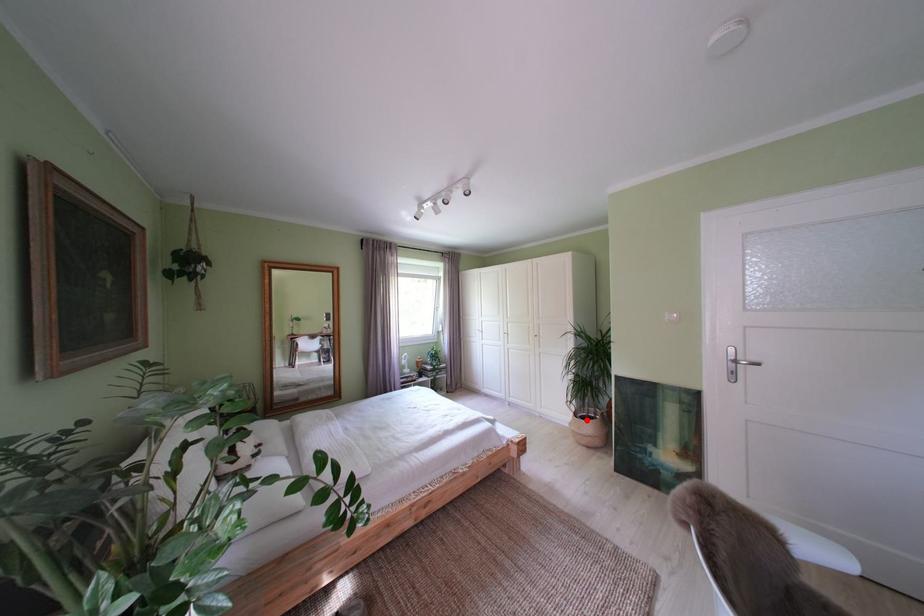
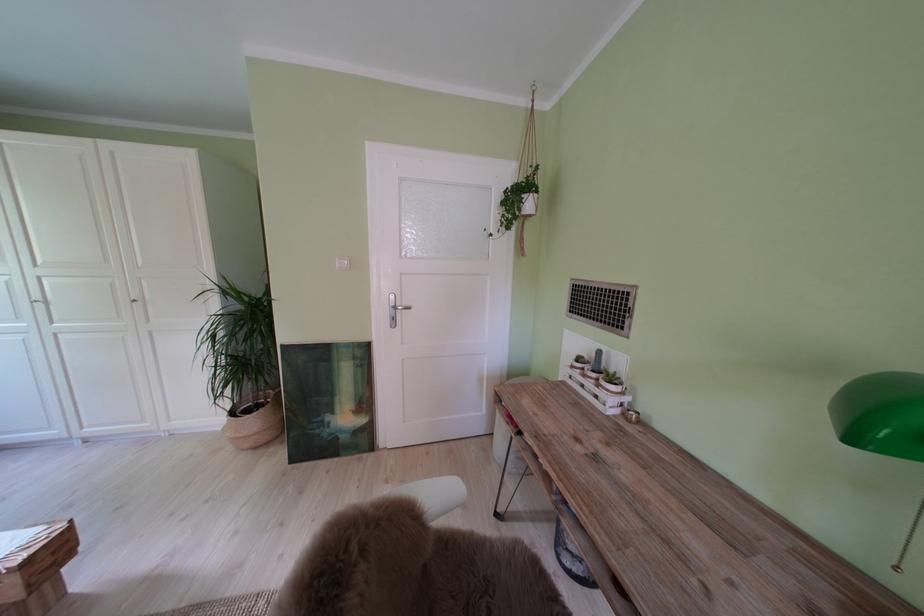
Question: I am providing you with two images of the same scene from different viewpoints. Image1 has a red point marked. In image2, the corresponding 3D location appears at what relative position? Reply with the corresponding letter.

Choices:
 (A) Closer
 (B) Farther

Answer: (A)